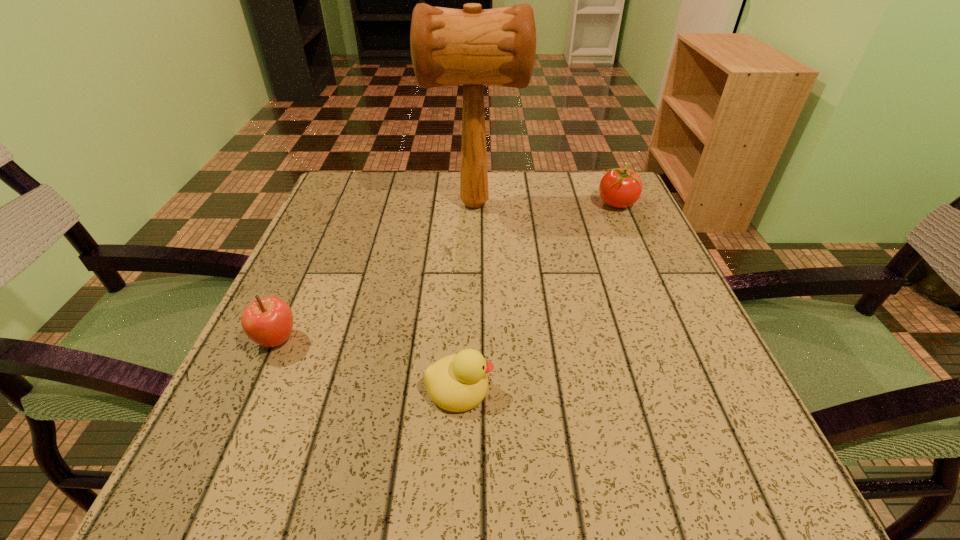
Where is `the tallest object`? This screenshot has width=960, height=540. the tallest object is located at coordinates coord(472,47).

I want to click on tomato, so click(620, 188).

Identify the location of the second nearest object. This screenshot has width=960, height=540. (268, 322).

Image resolution: width=960 pixels, height=540 pixels. I want to click on the leftmost object, so click(x=268, y=322).

Locate an element on the screen. The height and width of the screenshot is (540, 960). the shortest object is located at coordinates (458, 382).

This screenshot has width=960, height=540. Find the location of `duckling`. duckling is located at coordinates (458, 382).

Find the location of a particular element. This screenshot has height=540, width=960. vacant space situated 0.150m on the strike surface of the tallest object is located at coordinates (588, 204).

Find the location of `free space located 0.120m on the front of the tomato`. free space located 0.120m on the front of the tomato is located at coordinates (636, 247).

The image size is (960, 540). In order to click on free space located 0.290m on the right of the apple in this screenshot , I will do `click(475, 340)`.

Where is `vacant space situated on the face of the duckling`? vacant space situated on the face of the duckling is located at coordinates (641, 388).